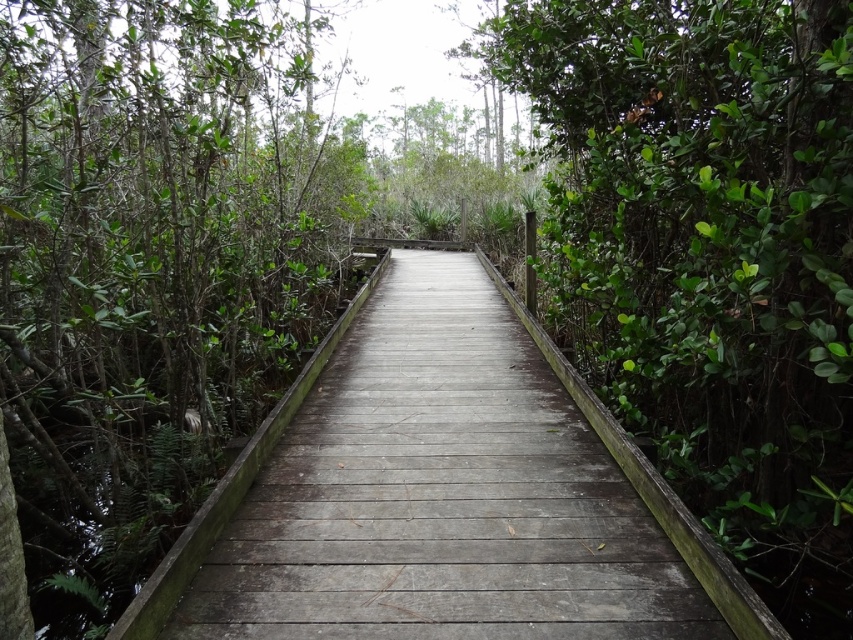
You are standing on the wooden boardwalk and see a point marked at coordinates (706, 244). What object is located at that point?

The point at coordinates (706, 244) corresponds to a green leafy bush at right.

You are standing on the boardwalk and want to take a photo of the green leafy tree at left. Which direction should you face to capture it in your shot?

You should face towards the left direction to capture the green leafy tree at left in your shot since it is located at point (152,268).

You are standing at the camera position and want to take a photo of the green leafy tree at left. If your camera has a maximum focus range of 8 feet, will you be able to capture the tree in focus?

The green leafy tree at left and camera are 8.26 feet apart from each other. Since the maximum focus range is 8 feet, the distance is slightly beyond the camera can focus, so the tree will be out of focus.